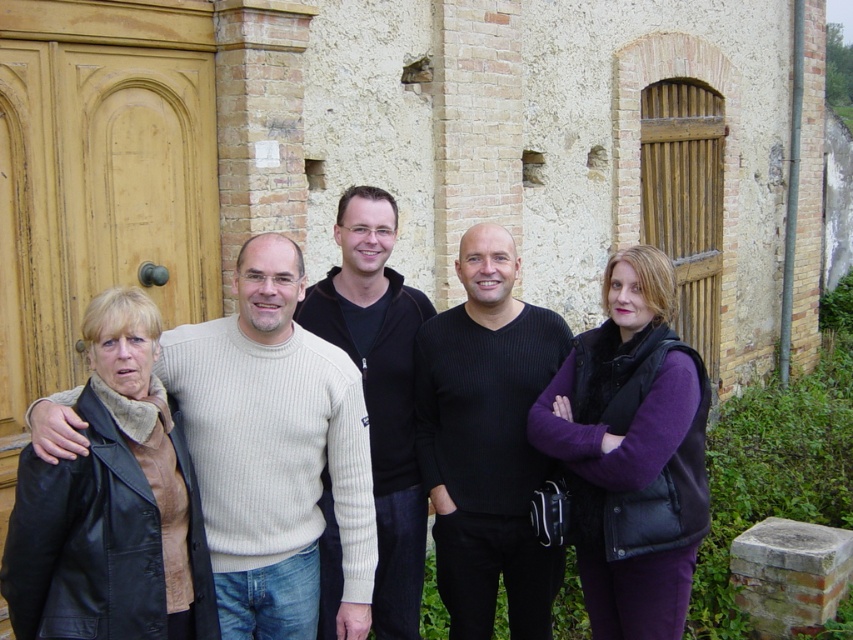
You are a photographer trying to capture a closeup of the purple matte vest at center and the black ribbed sweater at center. Since you can only focus on one at a time, which one should you choose to ensure the details are clearer in the photo?

The purple matte vest at center is larger in size compared to the black ribbed sweater at center, so focusing on the purple matte vest at center would allow for clearer details due to its larger surface area.

You are a photographer trying to capture a group photo of the five individuals standing in front of the rustic building. You notice the black leather jacket at lower left and the black ribbed sweater at center. Which clothing item should you focus on first if you want to ensure both are in sharp focus, considering their sizes?

The black leather jacket at lower left has a larger size compared to the black ribbed sweater at center, so you should focus on the black leather jacket at lower left first to ensure both are in sharp focus.

You are a photographer trying to capture a group photo where the purple matte vest at center and the matte black jacket at center are both visible. Given that the camera frame can only accommodate objects up to the width of the wider of the two, will both items fit within the frame?

The purple matte vest at center is narrower than the matte black jacket at center. Since the camera frame can accommodate up to the width of the wider item, which is the matte black jacket at center, both items will fit within the frame as the vest is narrower and the jacket is the maximum width allowed.